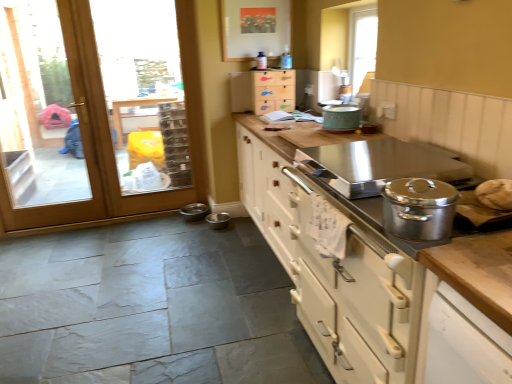
At what (x,y) coordinates should I click in order to perform the action: click on metallic stainless steel bowls at lower center, the second appliance in the right-to-left sequence. Please return your answer as a coordinate pair (x, y). Looking at the image, I should click on (194, 212).

Describe the element at coordinates (97, 110) in the screenshot. I see `wooden at left` at that location.

The image size is (512, 384). In order to click on metallic stainless steel bowl at lower center, arranged as the 2th appliance when viewed from the left in this screenshot , I will do `click(218, 220)`.

The height and width of the screenshot is (384, 512). I want to click on stainless steel countertop at center, so click(x=297, y=135).

Locate an element on the screen. The image size is (512, 384). metallic stainless steel bowls at lower center, the second appliance in the right-to-left sequence is located at coordinates (194, 212).

From a real-world perspective, is metallic stainless steel bowl at lower center, the first appliance viewed from the right, located beneath white wood cabinet at center, the first cabinetry viewed from the front?

Yes, from a real-world perspective, metallic stainless steel bowl at lower center, the first appliance viewed from the right, is beneath white wood cabinet at center, the first cabinetry viewed from the front.

How different are the orientations of metallic stainless steel bowl at lower center, the first appliance viewed from the right, and white wood cabinet at center, arranged as the 2th cabinetry when viewed from the back, in degrees?

90.6 degrees separate the facing orientations of metallic stainless steel bowl at lower center, the first appliance viewed from the right, and white wood cabinet at center, arranged as the 2th cabinetry when viewed from the back.

Which object is thinner, metallic stainless steel bowl at lower center, the first appliance viewed from the right, or white wood cabinet at center, the first cabinetry viewed from the front?

metallic stainless steel bowl at lower center, the first appliance viewed from the right, is thinner.

Would you say white wood cabinet at center, arranged as the 2th cabinetry when viewed from the back, is part of metallic stainless steel bowl at lower center, the first appliance viewed from the right,'s contents?

Definitely not — white wood cabinet at center, arranged as the 2th cabinetry when viewed from the back, is not inside metallic stainless steel bowl at lower center, the first appliance viewed from the right.

Is white wood cabinet at center, which is the 2th cabinetry from top to bottom, in front of wooden fish drawer at upper center, arranged as the 2th cabinetry when ordered from the bottom?

That is True.

Is white wood cabinet at center, the first cabinetry viewed from the front, thinner than wooden fish drawer at upper center, the 1th cabinetry viewed from the top?

In fact, white wood cabinet at center, the first cabinetry viewed from the front, might be wider than wooden fish drawer at upper center, the 1th cabinetry viewed from the top.

From the image's perspective, is white wood cabinet at center, which is the 2th cabinetry from top to bottom, located above wooden fish drawer at upper center, which ranks as the second cabinetry in front-to-back order?

No, from the image's perspective, white wood cabinet at center, which is the 2th cabinetry from top to bottom, is not above wooden fish drawer at upper center, which ranks as the second cabinetry in front-to-back order.

From a real-world perspective, which object stands above the other?

wooden fish drawer at upper center, arranged as the 2th cabinetry when ordered from the bottom, from a real-world perspective.

Who is more distant, wooden at left or teal matte pot at upper center?

wooden at left.

Is wooden at left not inside teal matte pot at upper center?

Yes.

Image resolution: width=512 pixels, height=384 pixels. I want to click on door above the teal matte pot at upper center (from the image's perspective), so click(x=97, y=110).

Which is behind, wooden fish drawer at upper center, the 1th cabinetry viewed from the top, or metallic stainless steel bowls at lower center, the 1th appliance in the left-to-right sequence?

metallic stainless steel bowls at lower center, the 1th appliance in the left-to-right sequence.

In terms of width, does wooden fish drawer at upper center, which is the 1th cabinetry from back to front, look wider or thinner when compared to metallic stainless steel bowls at lower center, the second appliance in the right-to-left sequence?

In the image, wooden fish drawer at upper center, which is the 1th cabinetry from back to front, appears to be more narrow than metallic stainless steel bowls at lower center, the second appliance in the right-to-left sequence.

Who is bigger, wooden fish drawer at upper center, which is the 1th cabinetry from back to front, or metallic stainless steel bowls at lower center, the second appliance in the right-to-left sequence?

wooden fish drawer at upper center, which is the 1th cabinetry from back to front, is bigger.

Does wooden fish drawer at upper center, which is the 1th cabinetry from back to front, contain metallic stainless steel bowls at lower center, the 1th appliance in the left-to-right sequence?

No.

Where is `door beneath the teal matte pot at upper center (from a real-world perspective)`? This screenshot has width=512, height=384. door beneath the teal matte pot at upper center (from a real-world perspective) is located at coordinates (97, 110).

Is teal matte pot at upper center at the left side of wooden at left?

No.

Can you see teal matte pot at upper center touching wooden at left?

No.

Between teal matte pot at upper center and wooden at left, which one has more height?

With more height is wooden at left.

Is teal matte pot at upper center located within white wood cabinet at center, which is the 2th cabinetry from top to bottom?

Actually, teal matte pot at upper center is outside white wood cabinet at center, which is the 2th cabinetry from top to bottom.

Is white wood cabinet at center, the 1th cabinetry positioned from the bottom, far away from teal matte pot at upper center?

white wood cabinet at center, the 1th cabinetry positioned from the bottom, is near teal matte pot at upper center, not far away.

Which object is thinner, white wood cabinet at center, arranged as the 2th cabinetry when viewed from the back, or teal matte pot at upper center?

teal matte pot at upper center is thinner.

From the image's perspective, would you say white wood cabinet at center, the 1th cabinetry positioned from the bottom, is positioned over teal matte pot at upper center?

No.

Which object is positioned more to the left, wooden fish drawer at upper center, the 1th cabinetry viewed from the top, or teal matte pot at upper center?

wooden fish drawer at upper center, the 1th cabinetry viewed from the top.

Considering the relative sizes of wooden fish drawer at upper center, the 1th cabinetry viewed from the top, and teal matte pot at upper center in the image provided, is wooden fish drawer at upper center, the 1th cabinetry viewed from the top, smaller than teal matte pot at upper center?

Actually, wooden fish drawer at upper center, the 1th cabinetry viewed from the top, might be larger than teal matte pot at upper center.

Is wooden fish drawer at upper center, which is the 1th cabinetry from back to front, with teal matte pot at upper center?

No, wooden fish drawer at upper center, which is the 1th cabinetry from back to front, is not beside teal matte pot at upper center.

From a real-world perspective, which object stands above the other?

In real-world perspective, wooden fish drawer at upper center, which ranks as the second cabinetry in front-to-back order, is above.

You are a GUI agent. You are given a task and a screenshot of the screen. Output one action in this format:
    pyautogui.click(x=<x>, y=<y>)
    Task: Click on the appliance that is the 1st one when counting backward from the white wood cabinet at center, the 1th cabinetry positioned from the bottom
    This screenshot has height=384, width=512.
    Given the screenshot: What is the action you would take?
    pyautogui.click(x=218, y=220)

Where is `cabinetry on the right side of wooden fish drawer at upper center, the 1th cabinetry viewed from the top`? The height and width of the screenshot is (384, 512). cabinetry on the right side of wooden fish drawer at upper center, the 1th cabinetry viewed from the top is located at coordinates (375, 260).

When comparing their distances from wooden fish drawer at upper center, which is the 1th cabinetry from back to front, does white wood cabinet at center, the 1th cabinetry positioned from the bottom, or stainless steel countertop at center seem further?

white wood cabinet at center, the 1th cabinetry positioned from the bottom, is further to wooden fish drawer at upper center, which is the 1th cabinetry from back to front.

Looking at the image, which one is located further to teal matte pot at upper center, white wood cabinet at center, which is the 2th cabinetry from top to bottom, or metallic stainless steel bowl at lower center, arranged as the 2th appliance when viewed from the left?

The object further to teal matte pot at upper center is metallic stainless steel bowl at lower center, arranged as the 2th appliance when viewed from the left.

Looking at this image, based on their spatial positions, is metallic stainless steel bowls at lower center, the 1th appliance in the left-to-right sequence, or white wood cabinet at center, the 1th cabinetry positioned from the bottom, further from metallic stainless steel bowl at lower center, the first appliance viewed from the right?

white wood cabinet at center, the 1th cabinetry positioned from the bottom, is positioned further to the anchor metallic stainless steel bowl at lower center, the first appliance viewed from the right.

Considering their positions, is stainless steel countertop at center positioned further to teal matte pot at upper center than wooden fish drawer at upper center, the 1th cabinetry viewed from the top?

wooden fish drawer at upper center, the 1th cabinetry viewed from the top, lies further to teal matte pot at upper center than the other object.

Estimate the real-world distances between objects in this image. Which object is closer to stainless steel countertop at center, white wood cabinet at center, the first cabinetry viewed from the front, or metallic stainless steel bowl at lower center, the first appliance viewed from the right?

white wood cabinet at center, the first cabinetry viewed from the front.

From the image, which object appears to be farther from wooden fish drawer at upper center, arranged as the 2th cabinetry when ordered from the bottom, metallic stainless steel bowls at lower center, the second appliance in the right-to-left sequence, or teal matte pot at upper center?

metallic stainless steel bowls at lower center, the second appliance in the right-to-left sequence, lies further to wooden fish drawer at upper center, arranged as the 2th cabinetry when ordered from the bottom, than the other object.

Based on their spatial positions, is wooden fish drawer at upper center, the 1th cabinetry viewed from the top, or wooden at left further from metallic stainless steel bowls at lower center, the second appliance in the right-to-left sequence?

The object further to metallic stainless steel bowls at lower center, the second appliance in the right-to-left sequence, is wooden at left.

When comparing their distances from wooden fish drawer at upper center, which ranks as the second cabinetry in front-to-back order, does wooden at left or stainless steel countertop at center seem closer?

Among the two, stainless steel countertop at center is located nearer to wooden fish drawer at upper center, which ranks as the second cabinetry in front-to-back order.

You are a GUI agent. You are given a task and a screenshot of the screen. Output one action in this format:
    pyautogui.click(x=<x>, y=<y>)
    Task: Click on the cabinetry between teal matte pot at upper center and metallic stainless steel bowl at lower center, arranged as the 2th appliance when viewed from the left, along the z-axis
    Image resolution: width=512 pixels, height=384 pixels.
    Given the screenshot: What is the action you would take?
    pyautogui.click(x=263, y=91)

The image size is (512, 384). Identify the location of counter top between white wood cabinet at center, which is the 2th cabinetry from top to bottom, and teal matte pot at upper center in the front-back direction. pyautogui.click(x=297, y=135).

What are the coordinates of `cabinetry between stainless steel countertop at center and metallic stainless steel bowl at lower center, the first appliance viewed from the right, along the z-axis` in the screenshot? It's located at [x=263, y=91].

You are a GUI agent. You are given a task and a screenshot of the screen. Output one action in this format:
    pyautogui.click(x=<x>, y=<y>)
    Task: Click on the appliance located between stainless steel countertop at center and metallic stainless steel bowls at lower center, the 1th appliance in the left-to-right sequence, in the depth direction
    The image size is (512, 384).
    Given the screenshot: What is the action you would take?
    pyautogui.click(x=218, y=220)